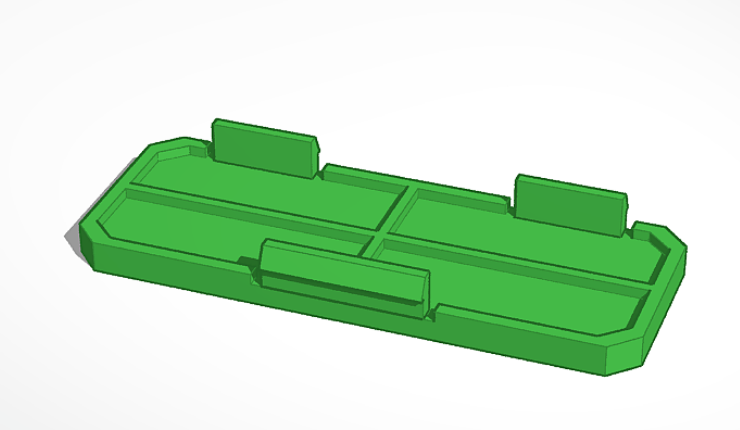
Where is `3d image of a type of a door`? Image resolution: width=740 pixels, height=430 pixels. 3d image of a type of a door is located at coordinates (340, 201).